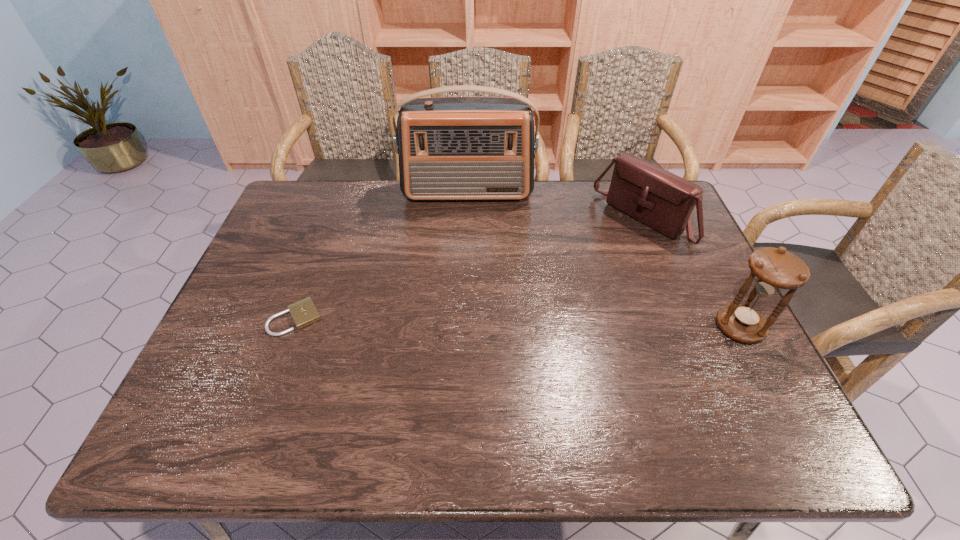
Image resolution: width=960 pixels, height=540 pixels. I want to click on free point between the shoulder bag and the hourglass, so click(x=690, y=274).

This screenshot has width=960, height=540. What are the coordinates of `empty space between the leftmost object and the second shortest object` in the screenshot? It's located at (468, 269).

At what (x,y) coordinates should I click in order to perform the action: click on unoccupied position between the shortest object and the hourglass. Please return your answer as a coordinate pair (x, y). Looking at the image, I should click on click(x=517, y=323).

At what (x,y) coordinates should I click in order to perform the action: click on vacant region between the leftmost object and the shoulder bag. Please return your answer as a coordinate pair (x, y). The width and height of the screenshot is (960, 540). Looking at the image, I should click on (468, 269).

The width and height of the screenshot is (960, 540). In order to click on free space between the third tallest object and the tallest object in this screenshot , I will do `click(555, 207)`.

Locate which object is the third closest to the padlock. Please provide its 2D coordinates. Your answer should be formatted as a tuple, i.e. [(x, y)], where the tuple contains the x and y coordinates of a point satisfying the conditions above.

[(773, 270)]

What are the coordinates of `object that ranks as the third closest to the leftmost object` in the screenshot? It's located at (773, 270).

The height and width of the screenshot is (540, 960). Find the location of `vacant space that satisfies the following two spatial constraints: 1. on the front side of the leftmost object; 2. on the right side of the third shortest object`. vacant space that satisfies the following two spatial constraints: 1. on the front side of the leftmost object; 2. on the right side of the third shortest object is located at coordinates (293, 327).

Where is `vacant area that satisfies the following two spatial constraints: 1. on the back side of the second shortest object; 2. on the left side of the padlock`? The height and width of the screenshot is (540, 960). vacant area that satisfies the following two spatial constraints: 1. on the back side of the second shortest object; 2. on the left side of the padlock is located at coordinates (332, 220).